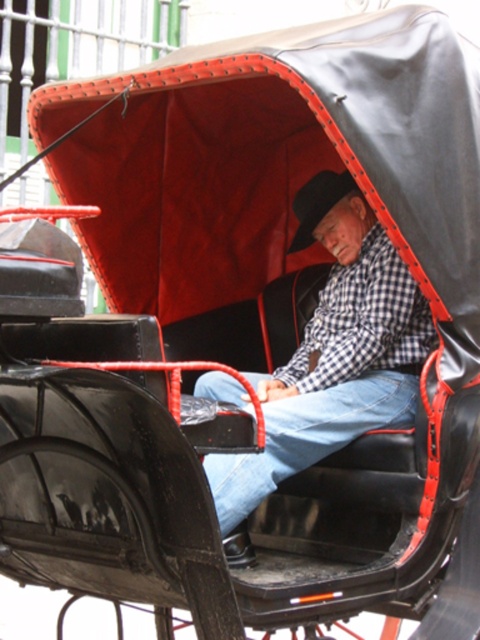
You are a tailor observing a man in a traditional horse carriage. You notice the checkered fabric shirt at center and the blue denim jeans at center. Which clothing item is positioned more to the left side of the scene?

The checkered fabric shirt at center is positioned to the left of the blue denim jeans at center, so it is more to the left side of the scene.

You are a fashion designer observing the man in the vintage carriage. You need to determine the arrangement of his clothing items. According to the image, which clothing item is positioned higher on his body between the checkered fabric shirt at center and the blue denim jeans at center?

The checkered fabric shirt at center is positioned higher on his body than the blue denim jeans at center, as it is above the jeans.

You are a tailor observing a man wearing a checkered fabric shirt at center and blue denim jeans at center. Which piece of clothing is higher on his body?

The checkered fabric shirt at center is taller than blue denim jeans at center, so the checkered fabric shirt at center is higher on his body.